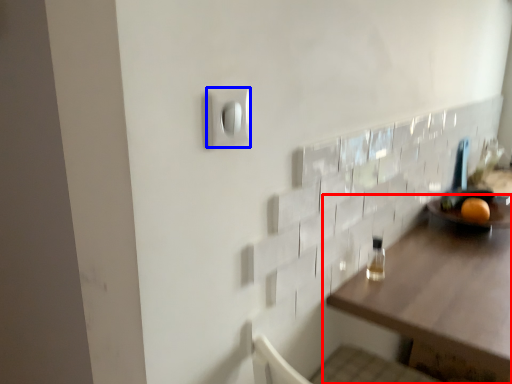
Question: Which of the following is the closest to the observer, table (highlighted by a red box) or light switch (highlighted by a blue box)?

Choices:
 (A) table
 (B) light switch

Answer: (B)